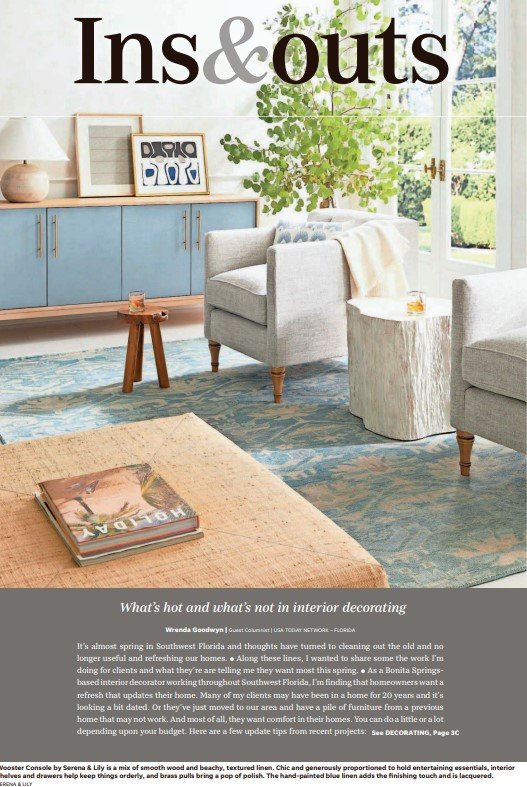
Identify the location of glass panes. (472, 194), (480, 108), (472, 47), (423, 190), (413, 130), (413, 28).